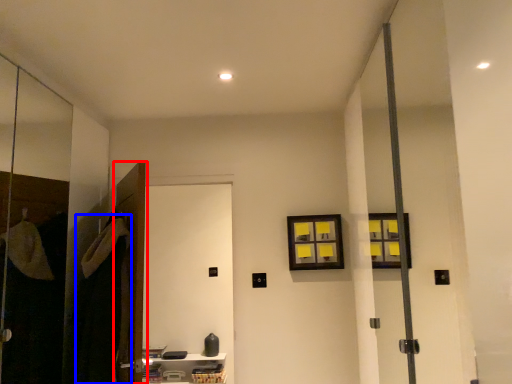
Question: Which of the following is the closest to the observer, door (highlighted by a red box) or robe (highlighted by a blue box)?

Choices:
 (A) door
 (B) robe

Answer: (B)